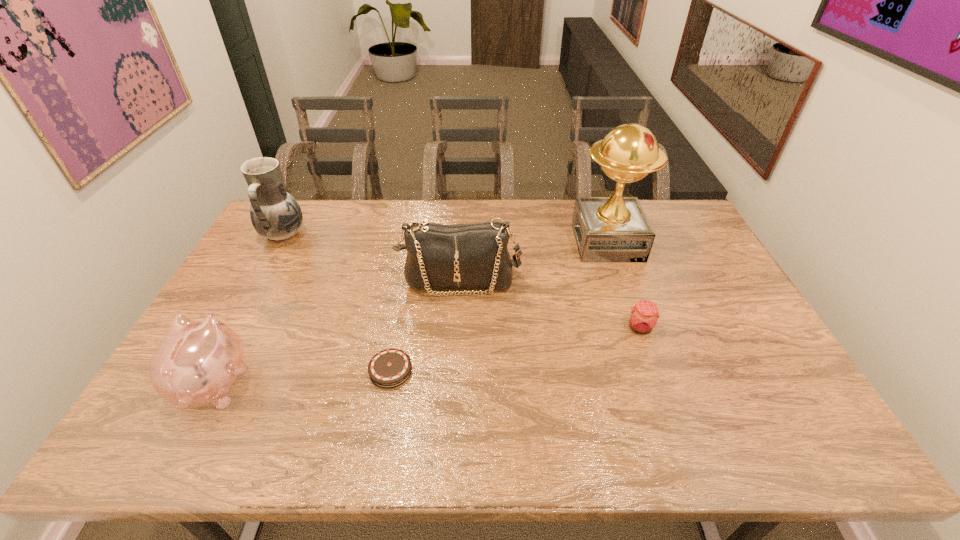
Locate an element on the screen. This screenshot has width=960, height=540. vacant position in the image that satisfies the following two spatial constraints: 1. on the front-facing side of the pitcher; 2. on the right side of the chocolate cake is located at coordinates (208, 370).

I want to click on free space that satisfies the following two spatial constraints: 1. on the front facing side of the piggy bank; 2. on the left side of the fifth tallest object, so click(244, 328).

Identify the location of vacant space that satisfies the following two spatial constraints: 1. on the front-facing side of the tallest object; 2. on the back side of the second shortest object. The width and height of the screenshot is (960, 540). (637, 328).

Identify the location of free point that satisfies the following two spatial constraints: 1. on the front facing side of the piggy bank; 2. on the right side of the jam. (244, 328).